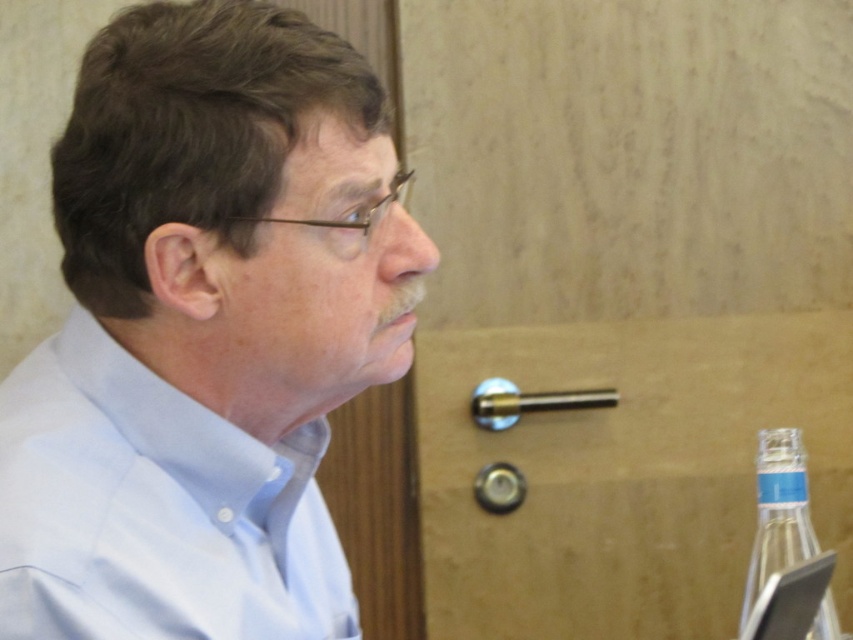
Based on the photo, you are a photographer adjusting your camera settings to capture a clear shot of the man in the scene. You notice two points marked at coordinates point (248, 426) and point (782, 438). Which point should you focus on to ensure the man is in sharp focus?

You should focus on point (248, 426) because it is closer to the camera than point (782, 438), ensuring the man remains in sharp focus.

You are a tailor measuring two light blue shirts for alterations. The first is the light blue shirt at center and the second is the light blue cotton shirt at left. Which shirt should you measure first if you want to start with the one closer to you?

The light blue shirt at center is closer to you, so you should measure it first.